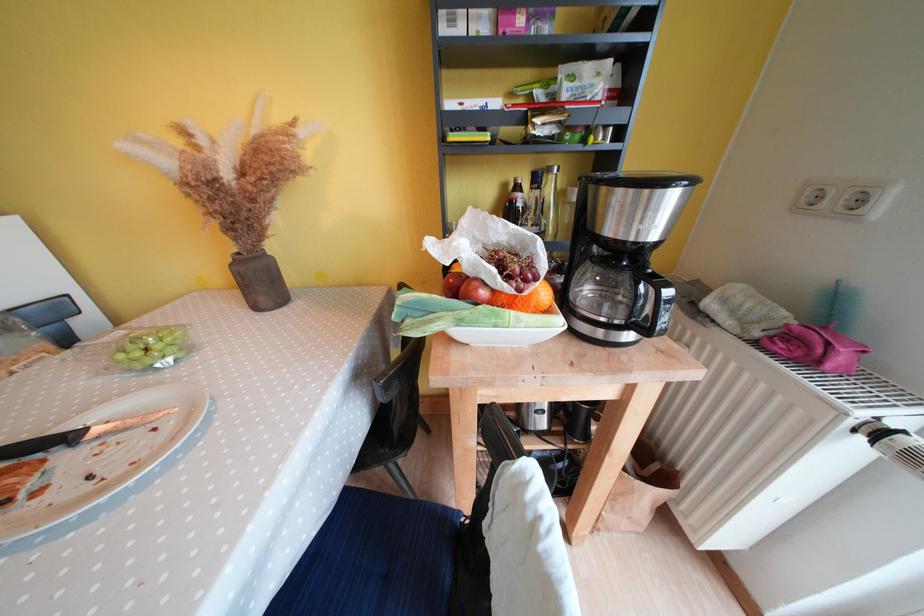
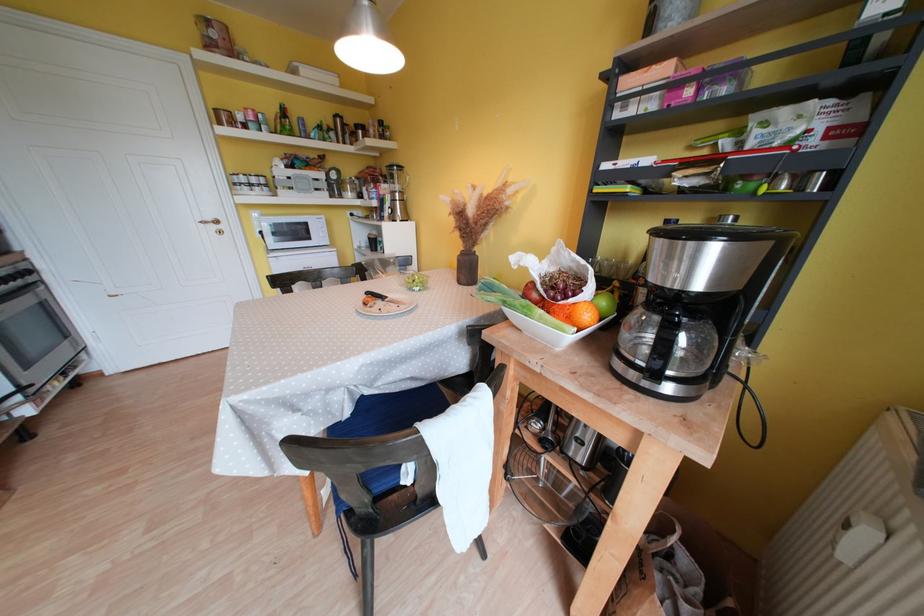
The point at (490, 297) is marked in the first image. Where is the corresponding point in the second image?

(541, 299)